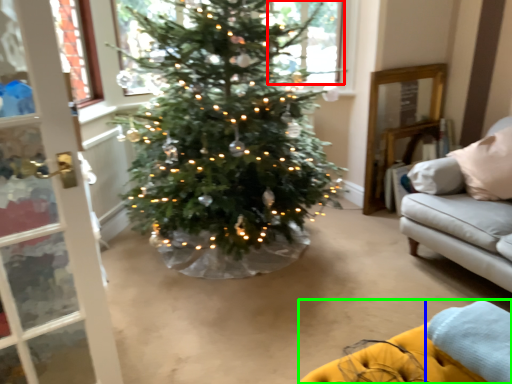
Question: Which is nearer to the window (highlighted by a red box)? blanket (highlighted by a blue box) or couch (highlighted by a green box).

Choices:
 (A) blanket
 (B) couch

Answer: (A)